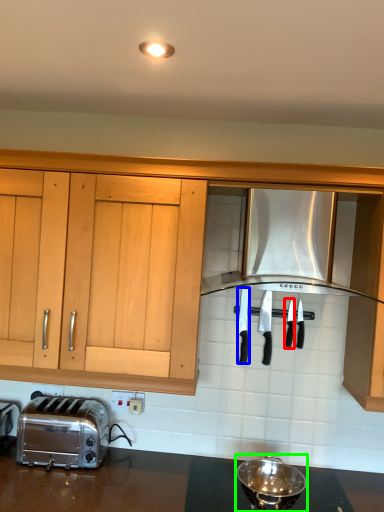
Question: Estimate the real-world distances between objects in this image. Which object is farther from silverware (highlighted by a red box), silverware (highlighted by a blue box) or appliance (highlighted by a green box)?

Choices:
 (A) silverware
 (B) appliance

Answer: (B)